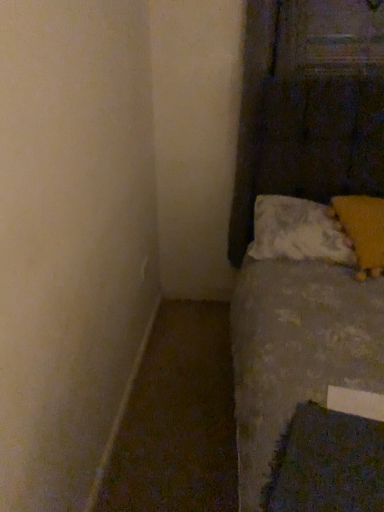
Question: Considering the relative sizes of dark blue textured sheet at lower right and yellow fuzzy pillow at upper right, acting as the second pillow starting from the left, in the image provided, is dark blue textured sheet at lower right thinner than yellow fuzzy pillow at upper right, acting as the second pillow starting from the left,?

Choices:
 (A) no
 (B) yes

Answer: (B)

Question: Is dark blue textured sheet at lower right oriented towards yellow fuzzy pillow at upper right, acting as the second pillow starting from the left?

Choices:
 (A) yes
 (B) no

Answer: (B)

Question: Considering the relative sizes of dark blue textured sheet at lower right and yellow fuzzy pillow at upper right, positioned as the first pillow in right-to-left order, in the image provided, is dark blue textured sheet at lower right taller than yellow fuzzy pillow at upper right, positioned as the first pillow in right-to-left order,?

Choices:
 (A) yes
 (B) no

Answer: (B)

Question: From the image's perspective, is dark blue textured sheet at lower right located above yellow fuzzy pillow at upper right, acting as the second pillow starting from the left?

Choices:
 (A) no
 (B) yes

Answer: (A)

Question: Does dark blue textured sheet at lower right have a greater width compared to yellow fuzzy pillow at upper right, positioned as the first pillow in right-to-left order?

Choices:
 (A) yes
 (B) no

Answer: (B)

Question: In terms of size, does dark blue textured sheet at lower right appear bigger or smaller than yellow fuzzy pillow at upper right, positioned as the first pillow in right-to-left order?

Choices:
 (A) small
 (B) big

Answer: (A)

Question: From a real-world perspective, is dark blue textured sheet at lower right positioned above or below yellow fuzzy pillow at upper right, positioned as the first pillow in right-to-left order?

Choices:
 (A) below
 (B) above

Answer: (A)

Question: Considering the relative positions of dark blue textured sheet at lower right and yellow fuzzy pillow at upper right, acting as the second pillow starting from the left, in the image provided, is dark blue textured sheet at lower right to the left or to the right of yellow fuzzy pillow at upper right, acting as the second pillow starting from the left,?

Choices:
 (A) right
 (B) left

Answer: (B)

Question: Considering the positions of dark blue textured sheet at lower right and yellow fuzzy pillow at upper right, positioned as the first pillow in right-to-left order, in the image, is dark blue textured sheet at lower right taller or shorter than yellow fuzzy pillow at upper right, positioned as the first pillow in right-to-left order,?

Choices:
 (A) tall
 (B) short

Answer: (B)

Question: Does point (370, 227) appear closer or farther from the camera than point (344, 249)?

Choices:
 (A) closer
 (B) farther

Answer: (A)

Question: From a real-world perspective, relative to white soft pillow at lower right, positioned as the first pillow in left-to-right order, is yellow fuzzy pillow at upper right, positioned as the first pillow in right-to-left order, vertically above or below?

Choices:
 (A) below
 (B) above

Answer: (B)

Question: In terms of size, does yellow fuzzy pillow at upper right, positioned as the first pillow in right-to-left order, appear bigger or smaller than white soft pillow at lower right, which is the 2th pillow from right to left?

Choices:
 (A) big
 (B) small

Answer: (B)

Question: Considering their positions, is yellow fuzzy pillow at upper right, positioned as the first pillow in right-to-left order, located in front of or behind white soft pillow at lower right, which is the 2th pillow from right to left?

Choices:
 (A) front
 (B) behind

Answer: (A)

Question: Based on their sizes in the image, would you say dark blue textured sheet at lower right is bigger or smaller than white soft pillow at lower right, positioned as the first pillow in left-to-right order?

Choices:
 (A) small
 (B) big

Answer: (A)

Question: Is dark blue textured sheet at lower right inside the boundaries of white soft pillow at lower right, which is the 2th pillow from right to left, or outside?

Choices:
 (A) inside
 (B) outside

Answer: (B)